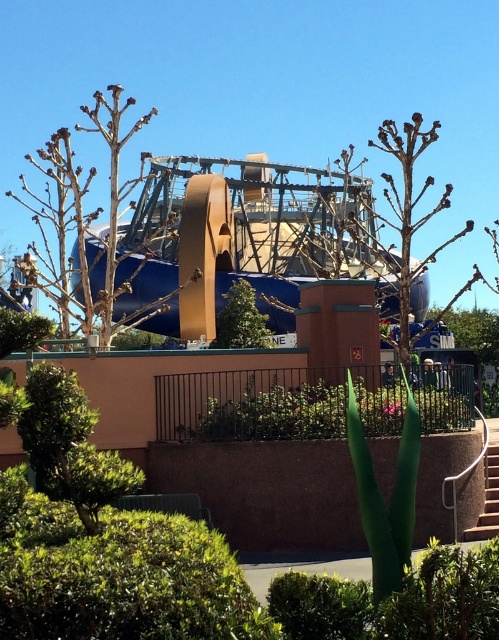
Question: Is green leafy hedge at center smaller than white concrete stairs at lower right?

Choices:
 (A) no
 (B) yes

Answer: (B)

Question: Can you confirm if green leafy tree at center is bigger than white concrete stairs at lower right?

Choices:
 (A) yes
 (B) no

Answer: (A)

Question: Which point is farther to the camera?

Choices:
 (A) white concrete stairs at lower right
 (B) green leafy hedge at center
 (C) green leafy tree at center

Answer: (C)

Question: Does green leafy hedge at center have a larger size compared to white concrete stairs at lower right?

Choices:
 (A) yes
 (B) no

Answer: (B)

Question: Which is nearer to the green leafy tree at center?

Choices:
 (A) white concrete stairs at lower right
 (B) green leafy hedge at center

Answer: (A)

Question: Which of the following is the closest to the observer?

Choices:
 (A) white concrete stairs at lower right
 (B) green leafy tree at center
 (C) green leafy hedge at center

Answer: (A)